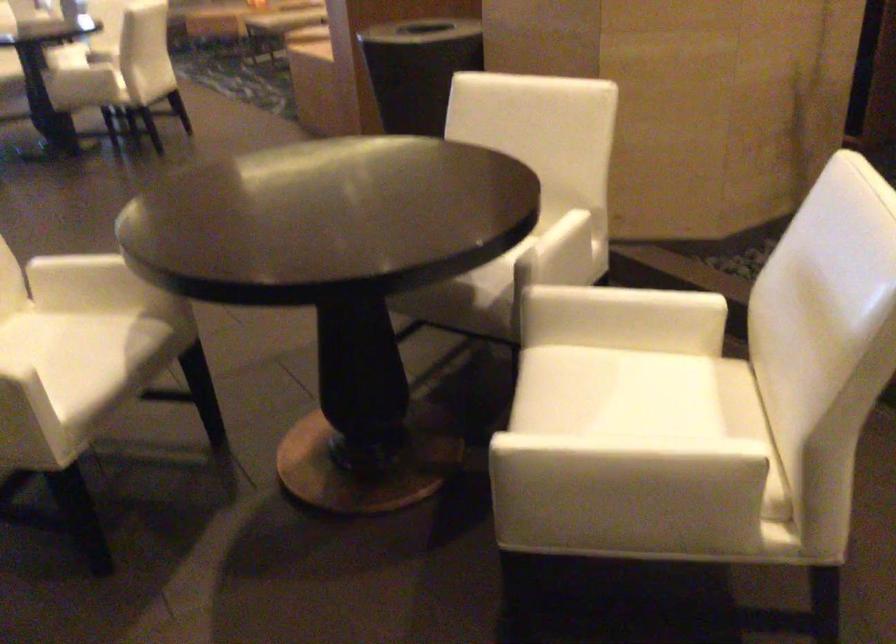
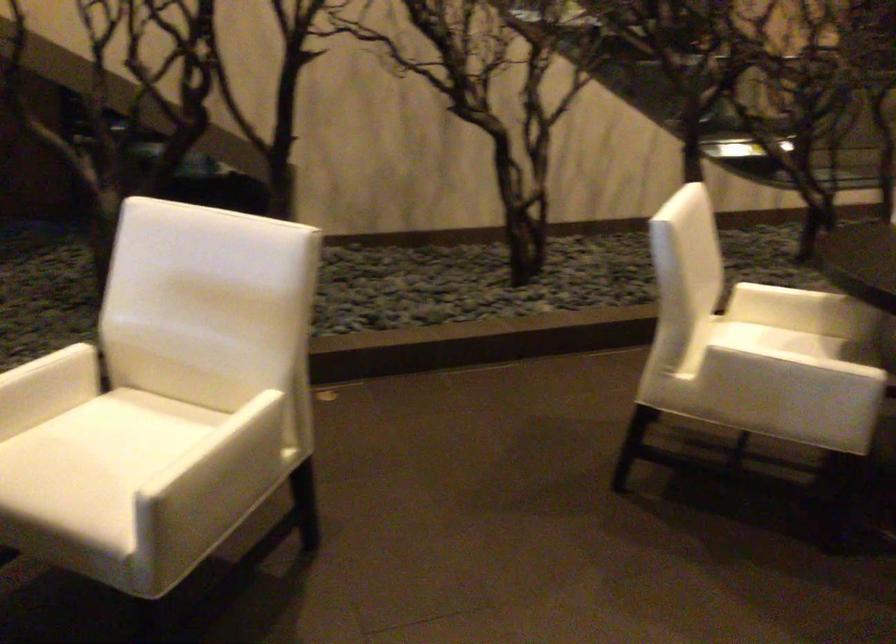
Find the pixel in the second image that matches (x=615, y=406) in the first image.

(105, 458)